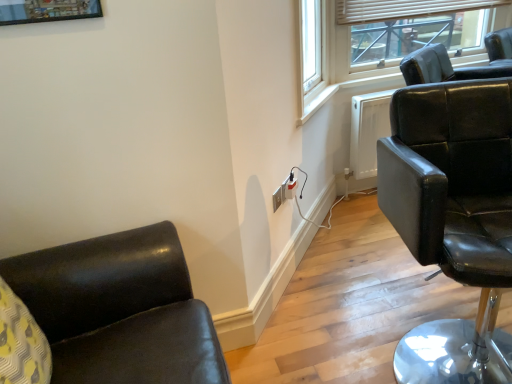
Question: From a real-world perspective, is matte black chair at upper right located higher than white plastic outlet at center, which ranks as the first electric outlet in front-to-back order?

Choices:
 (A) no
 (B) yes

Answer: (B)

Question: Considering the relative positions of matte black chair at upper right and white plastic outlet at center, the second electric outlet in the right-to-left sequence, in the image provided, is matte black chair at upper right to the right of white plastic outlet at center, the second electric outlet in the right-to-left sequence, from the viewer's perspective?

Choices:
 (A) no
 (B) yes

Answer: (B)

Question: Is matte black chair at upper right smaller than white plastic outlet at center, which ranks as the first electric outlet in front-to-back order?

Choices:
 (A) yes
 (B) no

Answer: (B)

Question: From the image's perspective, does matte black chair at upper right appear higher than white plastic outlet at center, the second electric outlet in the right-to-left sequence?

Choices:
 (A) yes
 (B) no

Answer: (A)

Question: Is matte black chair at upper right oriented towards white plastic outlet at center, which ranks as the first electric outlet in front-to-back order?

Choices:
 (A) no
 (B) yes

Answer: (A)

Question: Is matte black socket at lower right, which is the 2th electric outlet in left-to-right order, to the left or to the right of matte black chair at right in the image?

Choices:
 (A) left
 (B) right

Answer: (A)

Question: From a real-world perspective, is matte black socket at lower right, which is the 2th electric outlet in left-to-right order, above or below matte black chair at right?

Choices:
 (A) above
 (B) below

Answer: (B)

Question: Which is correct: matte black socket at lower right, the 2th electric outlet viewed from the front, is inside matte black chair at right, or outside of it?

Choices:
 (A) outside
 (B) inside

Answer: (A)

Question: Is matte black socket at lower right, the 2th electric outlet viewed from the front, in front of or behind matte black chair at right in the image?

Choices:
 (A) front
 (B) behind

Answer: (B)

Question: Does point (362, 57) appear closer or farther from the camera than point (279, 198)?

Choices:
 (A) farther
 (B) closer

Answer: (A)

Question: From a real-world perspective, is matte black chair at upper right physically located above or below white plastic outlet at center, the second electric outlet in the right-to-left sequence?

Choices:
 (A) above
 (B) below

Answer: (A)

Question: Is matte black chair at upper right taller or shorter than white plastic outlet at center, the second electric outlet in the right-to-left sequence?

Choices:
 (A) short
 (B) tall

Answer: (B)

Question: Based on their positions, is matte black chair at upper right located to the left or right of white plastic outlet at center, the second electric outlet viewed from the back?

Choices:
 (A) right
 (B) left

Answer: (A)

Question: From a real-world perspective, is matte black socket at lower right, which is the 2th electric outlet in left-to-right order, positioned above or below matte black chair at upper right?

Choices:
 (A) above
 (B) below

Answer: (B)

Question: In terms of width, does matte black socket at lower right, the 1th electric outlet positioned from the back, look wider or thinner when compared to matte black chair at upper right?

Choices:
 (A) thin
 (B) wide

Answer: (A)